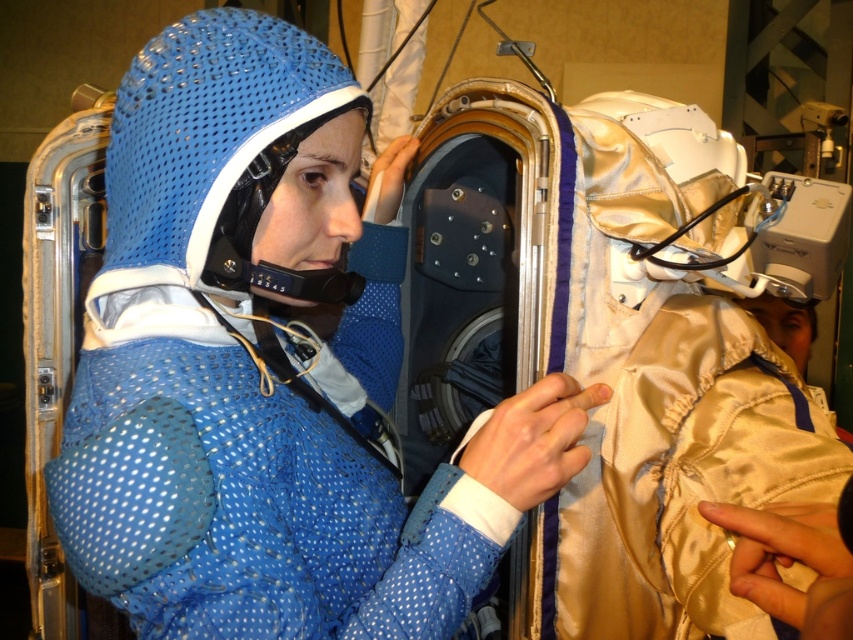
You are an astronaut in training and need to locate two points on your spacesuit. The first point is at coordinates point (299, 536) and the second is at point (212, 77). Which point is closer to you when facing the spacesuit?

Point (212, 77) is closer to you because it is in front of point (299, 536).

You are an astronaut preparing for a mission and need to put on your gear. You see the blue mesh suit at center and the blue mesh helmet at center. Which one should you put on first according to their positions?

The blue mesh helmet at center is to the left of the blue mesh suit at center, so you should put on the blue mesh helmet at center first since it is positioned to the left and typically helmets are donned before the full suit.